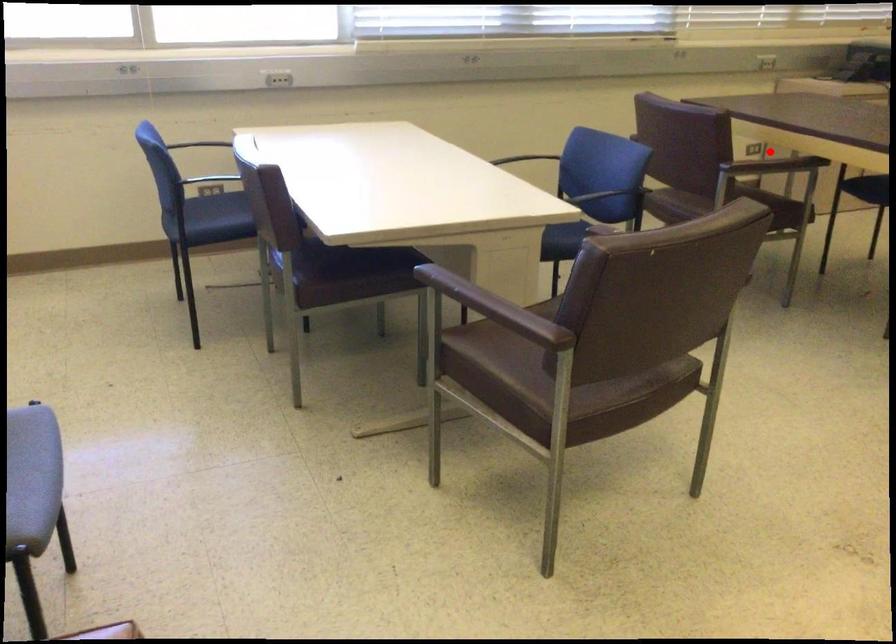
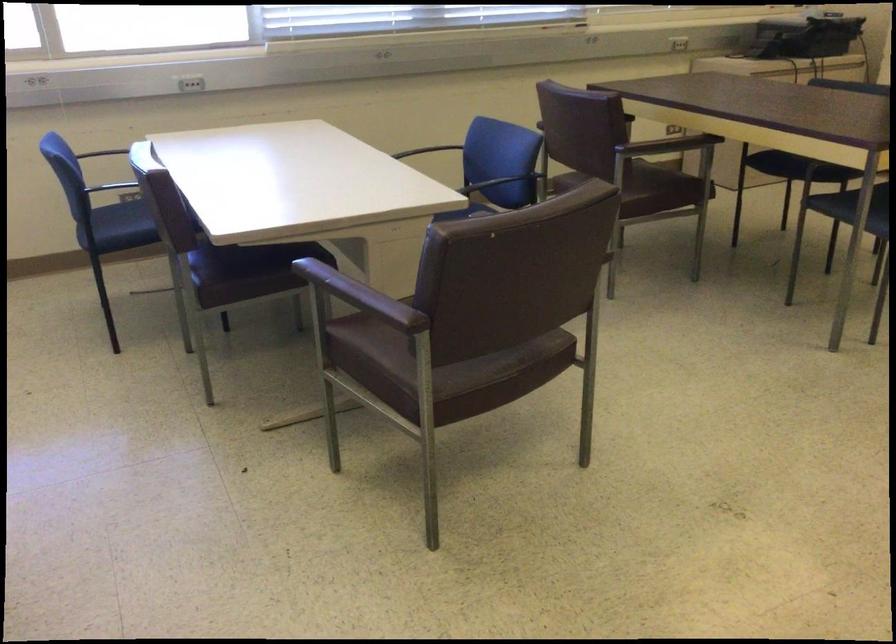
Question: I am providing you with two images of the same scene from different viewpoints. A red point is marked on the first image. Can you still see the location of the red point in image 2?

Choices:
 (A) Yes
 (B) No

Answer: (B)